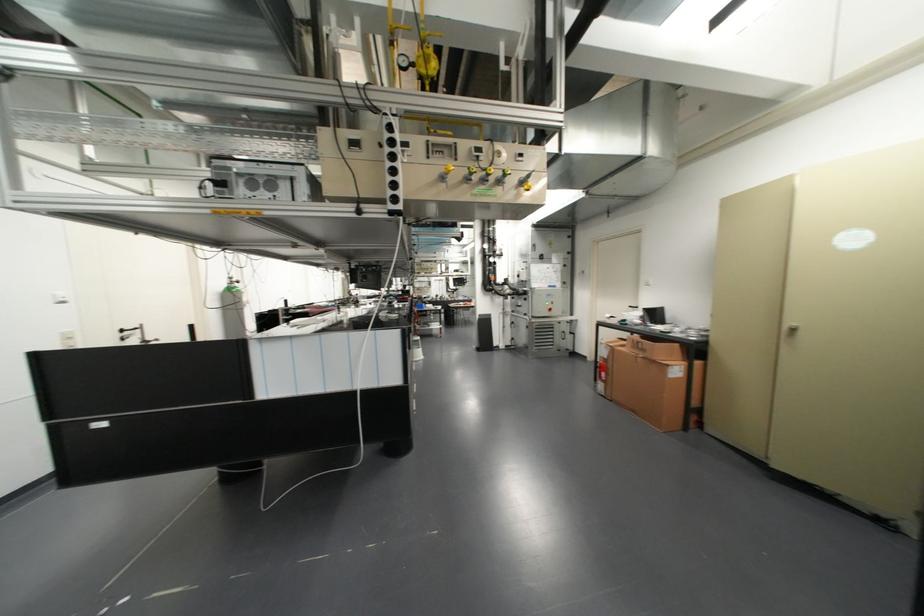
The width and height of the screenshot is (924, 616). Identify the location of black control knob. (392, 163).